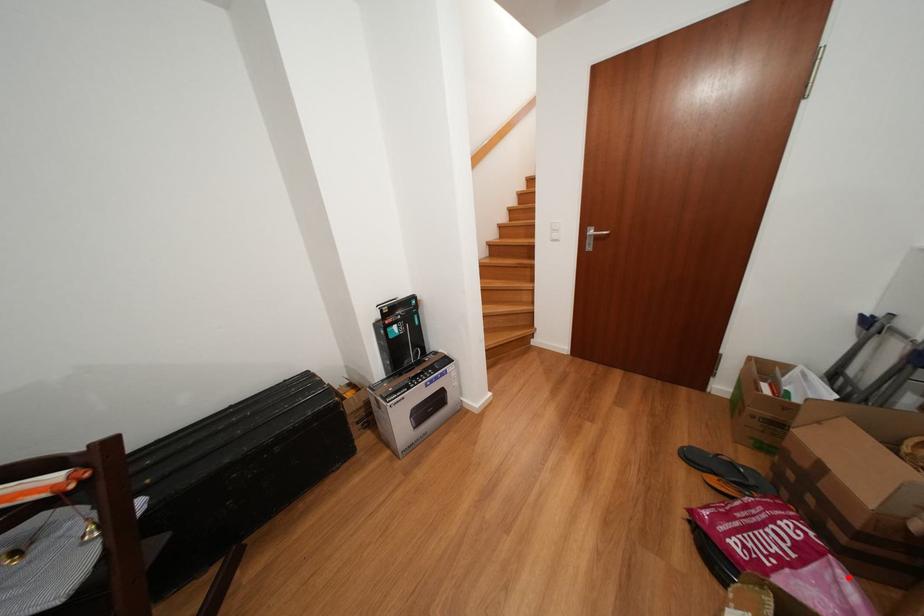
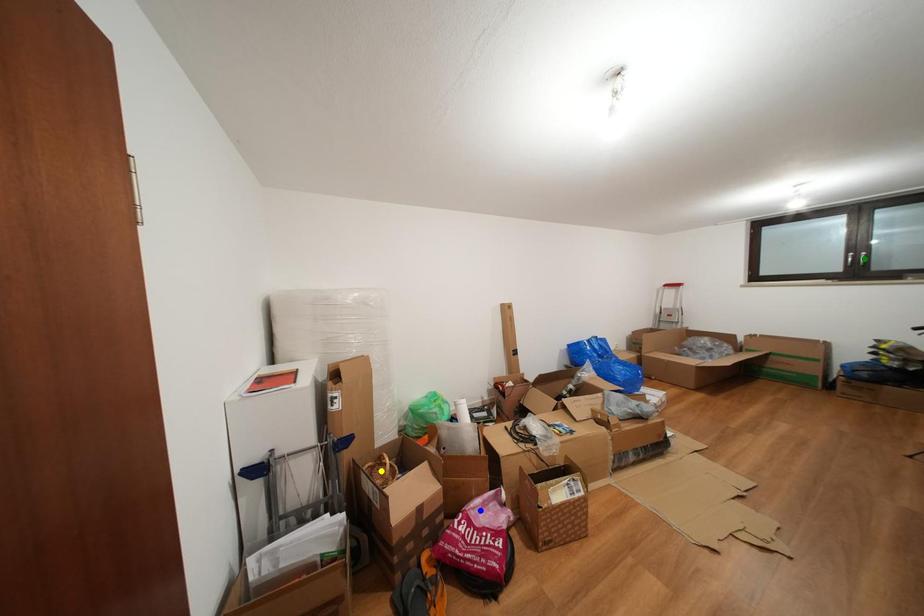
Question: I am providing you with two images of the same scene from different viewpoints. A red point is marked on the first image. You are given multiple points on the second image. Which point in image 2 is actually the same real-world point as the red point in image 1?

Choices:
 (A) green point
 (B) blue point
 (C) yellow point

Answer: (B)